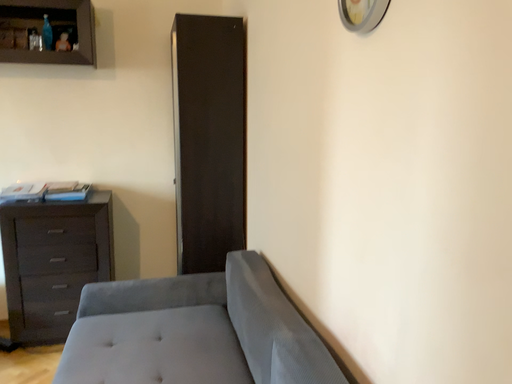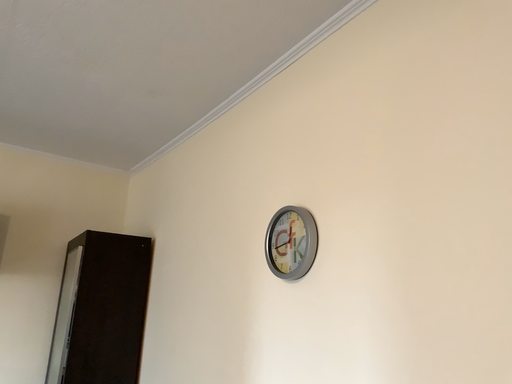
Question: Which way did the camera rotate in the video?

Choices:
 (A) rotated right
 (B) rotated left

Answer: (A)